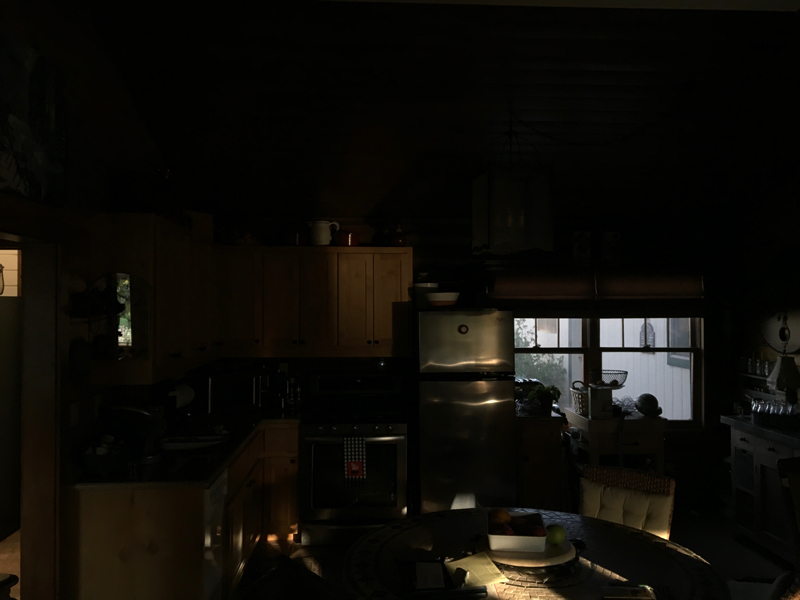
Find the location of a particular element. stove knobs is located at coordinates (322, 430), (333, 429), (356, 427), (376, 427), (390, 427).